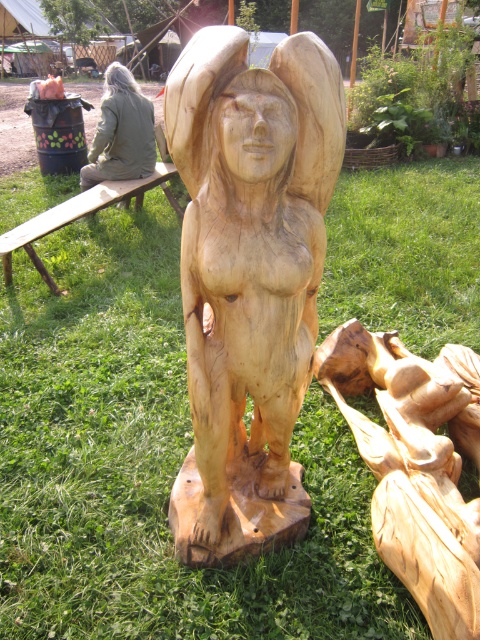
You are a photographer trying to capture both the natural wood statue at center and the green fabric jacket at left in the same frame. Based on their sizes, which object should you focus on first to ensure both are in the frame?

The natural wood statue at center is much taller than the green fabric jacket at left, so you should focus on the natural wood statue at center first to ensure both are in the frame.

You are standing in a park and see a wooden sculpture of a nude female figure standing upright on a grassy area. There is a point at coordinates (249,275) in the image. What does this point correspond to?

The point at coordinates (249,275) corresponds to the natural wood statue at center.

Consider the image. You are an art student trying to sketch the scene. You need to position the natural wood carving at center and the green fabric jacket at left correctly in your drawing. Based on the scene, which object should be placed on the left side of your paper?

The green fabric jacket at left should be placed on the left side of the paper because the natural wood carving at center is to the right of it.